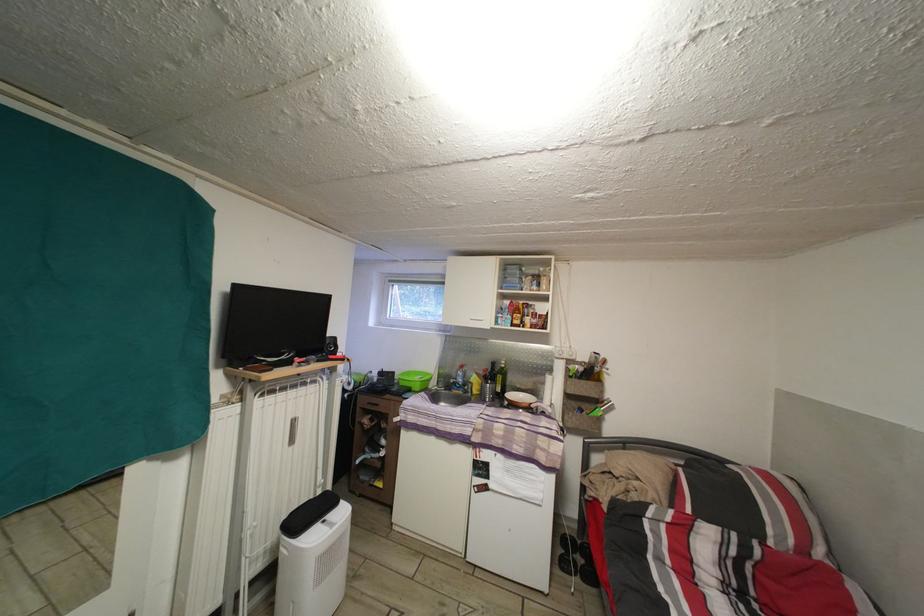
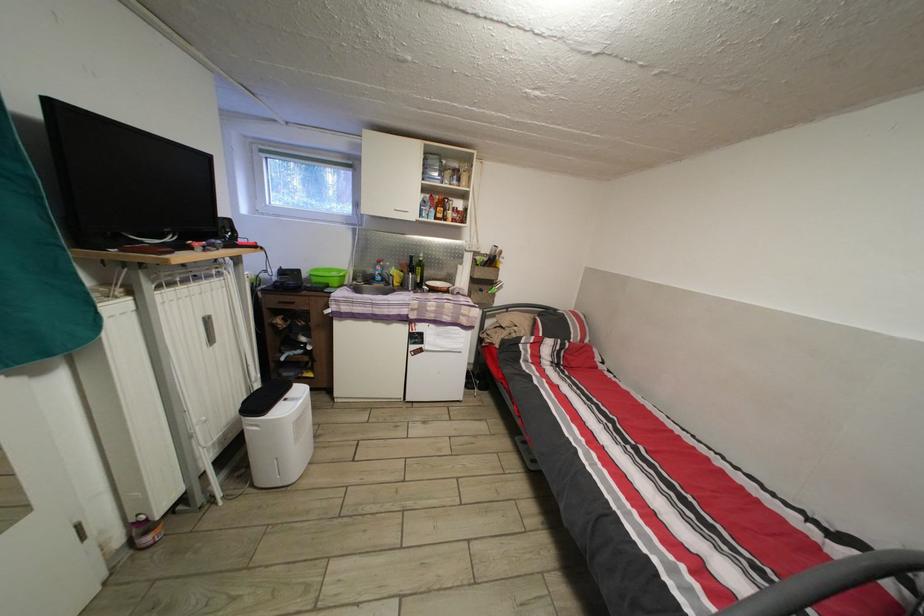
The images are taken continuously from a first-person perspective. In which direction is your viewpoint rotating?

The camera's rotation is toward right-down.